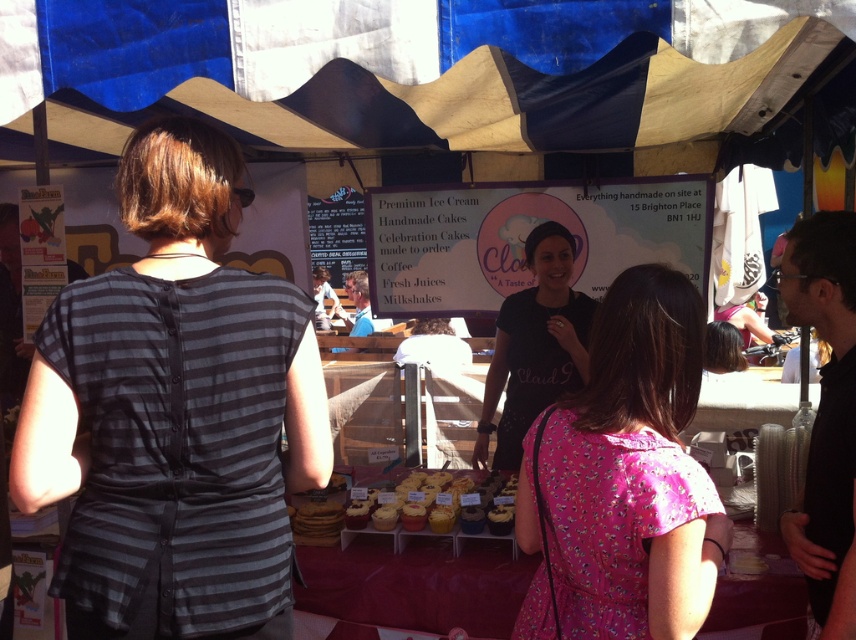
Can you confirm if dark gray striped shirt at left is positioned to the left of yellow frosted cupcakes at center?

Indeed, dark gray striped shirt at left is positioned on the left side of yellow frosted cupcakes at center.

Is dark gray striped shirt at left smaller than yellow frosted cupcakes at center?

Incorrect, dark gray striped shirt at left is not smaller in size than yellow frosted cupcakes at center.

Locate an element on the screen. dark gray striped shirt at left is located at coordinates (x=175, y=412).

Which of these two, black matte shirt at center or yellow frosted cupcakes at center, stands shorter?

yellow frosted cupcakes at center is shorter.

Is black matte shirt at center bigger than yellow frosted cupcakes at center?

Indeed, black matte shirt at center has a larger size compared to yellow frosted cupcakes at center.

In order to click on black matte shirt at center in this screenshot , I will do `click(535, 346)`.

Is point (280, 372) positioned in front of point (550, 548)?

Yes, point (280, 372) is closer to viewer.

Based on the photo, is dark gray striped shirt at left in front of pink floral dress at center?

No, it is behind pink floral dress at center.

At what (x,y) coordinates should I click in order to perform the action: click on dark gray striped shirt at left. Please return your answer as a coordinate pair (x, y). Looking at the image, I should click on 175,412.

Identify the location of dark gray striped shirt at left. Image resolution: width=856 pixels, height=640 pixels. (175, 412).